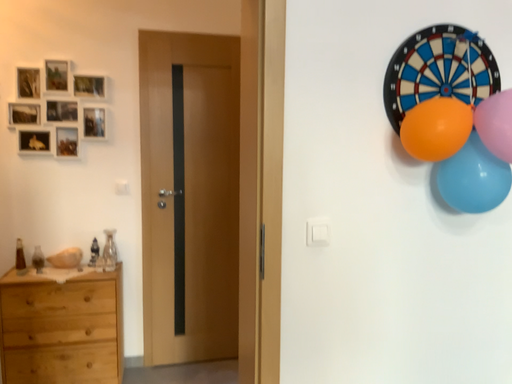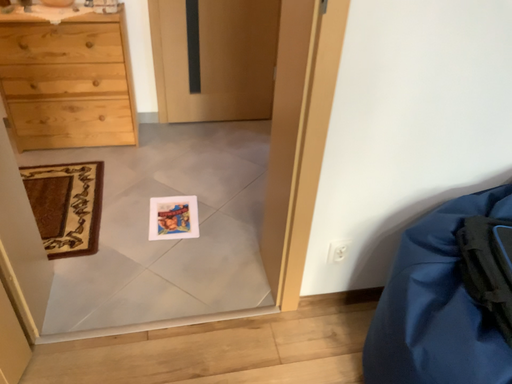
Question: How did the camera likely rotate when shooting the video?

Choices:
 (A) rotated downward
 (B) rotated upward

Answer: (A)